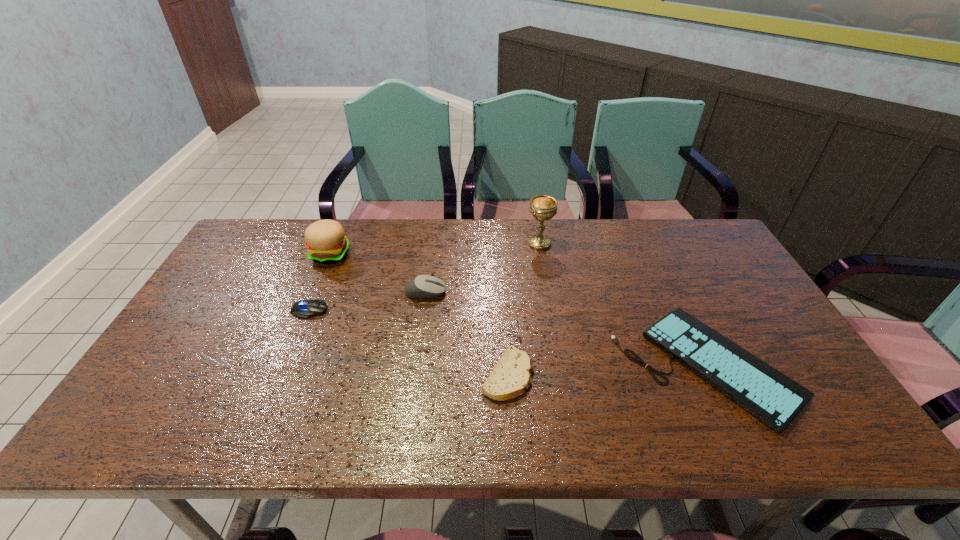
Find the location of `blank area at the far edge`. blank area at the far edge is located at coordinates (377, 227).

The height and width of the screenshot is (540, 960). In order to click on vacant region at the near edge of the desktop in this screenshot , I will do `click(476, 425)`.

This screenshot has width=960, height=540. I want to click on vacant position at the left edge of the desktop, so click(162, 354).

The image size is (960, 540). I want to click on free space at the right edge of the desktop, so click(711, 301).

The width and height of the screenshot is (960, 540). In the image, there is a desktop. Identify the location of vacant space at the far left corner. (260, 232).

Where is `vacant space at the near left corner of the desktop`? The image size is (960, 540). vacant space at the near left corner of the desktop is located at coordinates (177, 441).

Identify the location of vacant space at the far right corner. This screenshot has width=960, height=540. (707, 262).

This screenshot has height=540, width=960. In order to click on free space between the shorter computer mouse and the fifth shortest object in this screenshot , I will do `click(320, 282)`.

This screenshot has width=960, height=540. I want to click on free spot between the tallest object and the fourth object from right to left, so click(x=483, y=268).

You are a GUI agent. You are given a task and a screenshot of the screen. Output one action in this format:
    pyautogui.click(x=<x>, y=<y>)
    Task: Click on the vacant area that lies between the third object from right to left and the fifth object from left to right
    
    Given the screenshot: What is the action you would take?
    pyautogui.click(x=524, y=309)